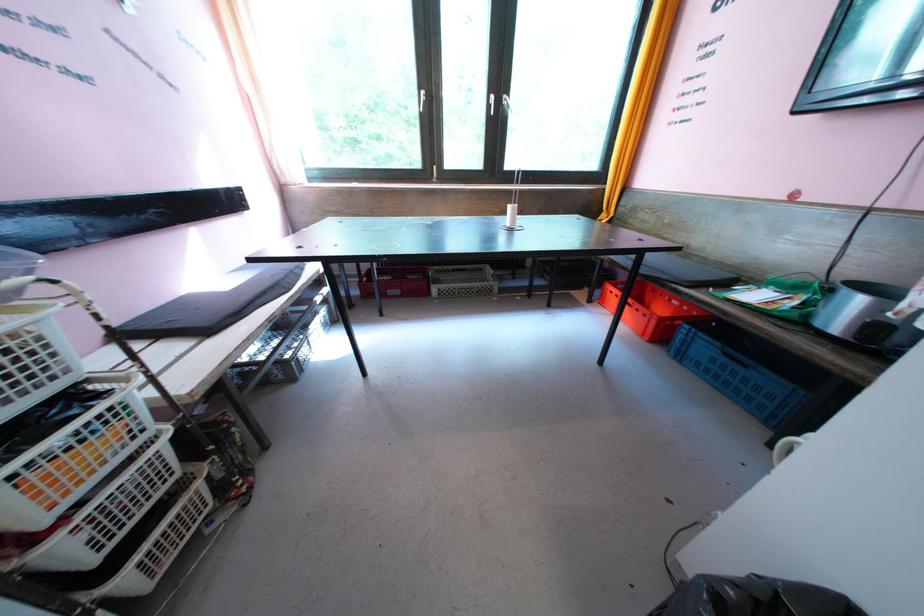
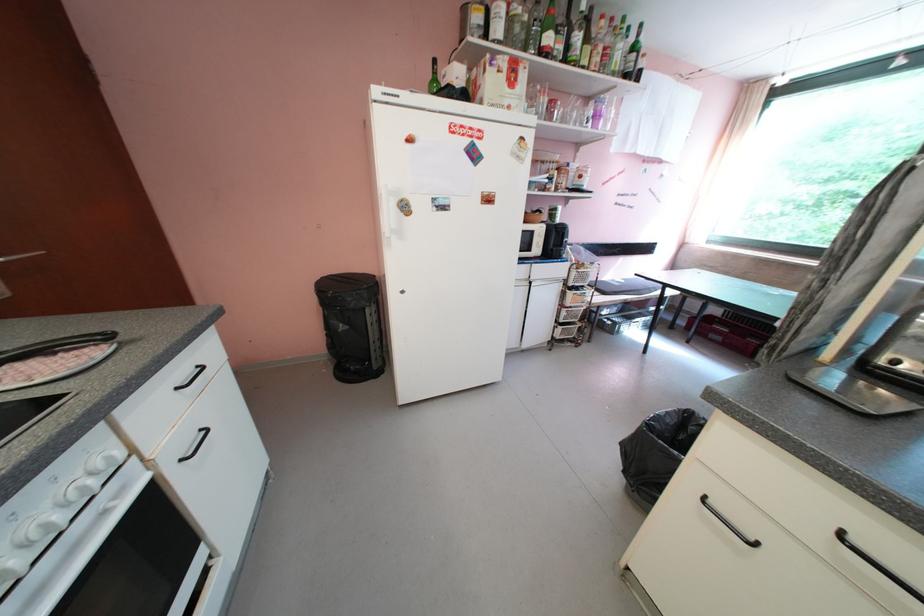
In the second image, find the point that corresponds to the point at 111,397 in the first image.

(593, 293)